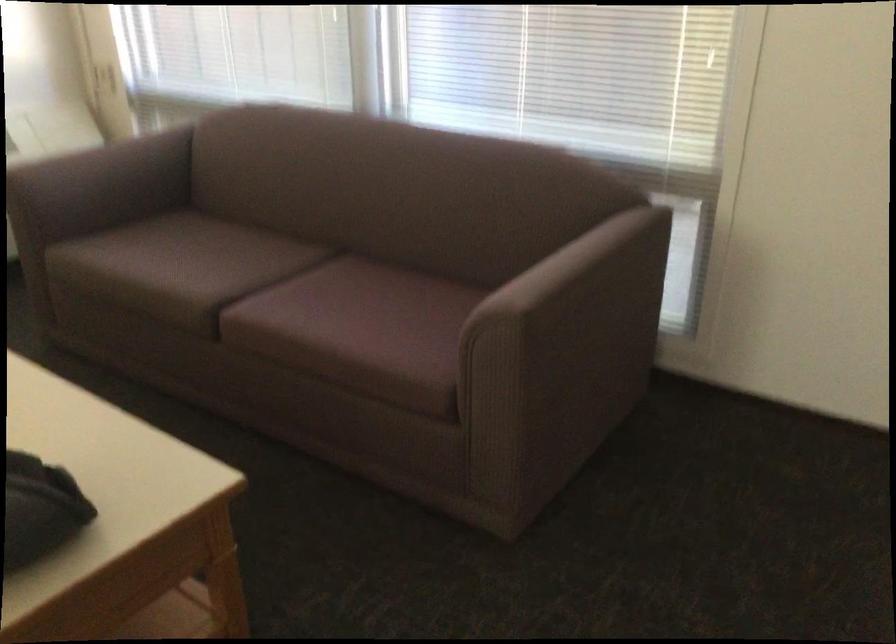
Find the location of a particular element. sofa sitting surface is located at coordinates (277, 299).